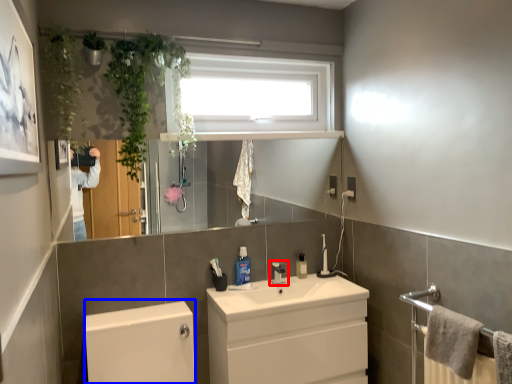
Question: Which of the following is the closest to the observer, tap (highlighted by a red box) or bath (highlighted by a blue box)?

Choices:
 (A) tap
 (B) bath

Answer: (B)